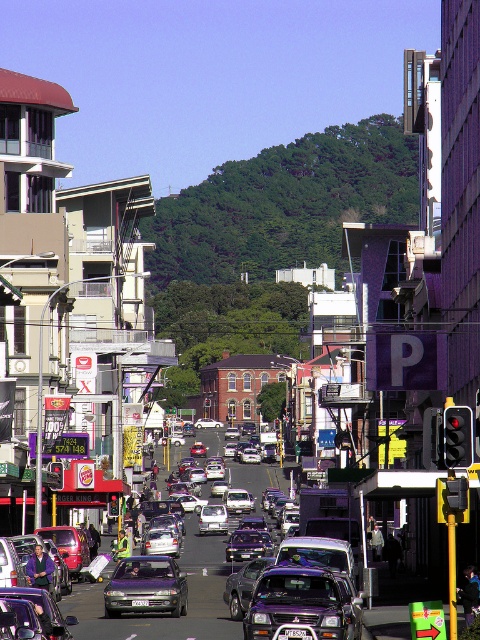
Who is shorter, metallic purple sedan at center or black plastic license plate at center?

black plastic license plate at center is shorter.

Which is behind, point (240, 531) or point (300, 637)?

The point (240, 531) is behind.

Who is more distant from viewer, [239,545] or [299,632]?

The point [239,545] is more distant.

Identify the location of metallic purple sedan at center. This screenshot has height=640, width=480. (247, 545).

Which is below, purple metallic suv at center or metallic purple sedan at center?

metallic purple sedan at center

Does purple metallic suv at center have a greater height compared to metallic purple sedan at center?

No, purple metallic suv at center is not taller than metallic purple sedan at center.

Identify the location of purple metallic suv at center. (300, 604).

Find the location of a particular element. This screenshot has width=480, height=640. purple metallic suv at center is located at coordinates (300, 604).

Between purple metallic sedan at center and white plastic license plate at center, which one appears on the left side from the viewer's perspective?

purple metallic sedan at center

Which is in front, point (124, 557) or point (144, 602)?

Point (144, 602)

Image resolution: width=480 pixels, height=640 pixels. Identify the location of purple metallic sedan at center. (145, 586).